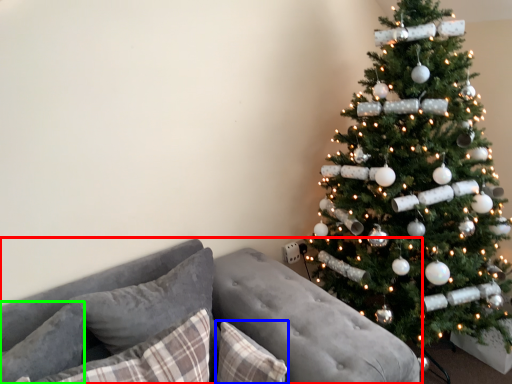
Question: Which object is positioned farthest from studio couch (highlighted by a red box)? Select from pillow (highlighted by a blue box) and pillow (highlighted by a green box).

Choices:
 (A) pillow
 (B) pillow

Answer: (B)